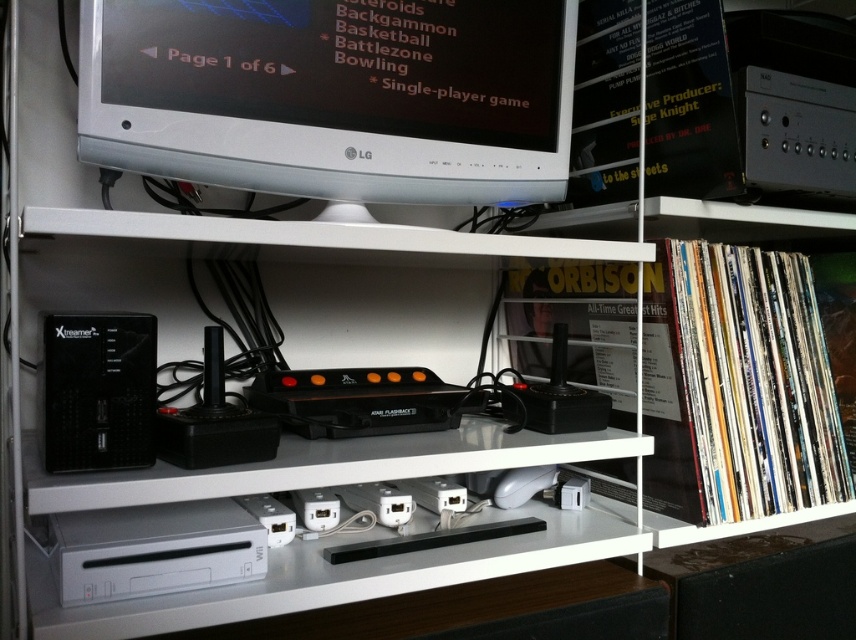
Question: Can you confirm if white glossy computer monitor at upper center is positioned to the left of black plastic speaker at left?

Choices:
 (A) no
 (B) yes

Answer: (A)

Question: Which object appears closest to the camera in this image?

Choices:
 (A) white glossy computer monitor at upper center
 (B) black plastic speaker at left

Answer: (B)

Question: Is white glossy computer monitor at upper center closer to the viewer compared to black plastic speaker at left?

Choices:
 (A) yes
 (B) no

Answer: (B)

Question: Can you confirm if white glossy computer monitor at upper center is smaller than black plastic speaker at left?

Choices:
 (A) no
 (B) yes

Answer: (A)

Question: Among these objects, which one is farthest from the camera?

Choices:
 (A) black plastic speaker at left
 (B) white glossy computer monitor at upper center

Answer: (B)